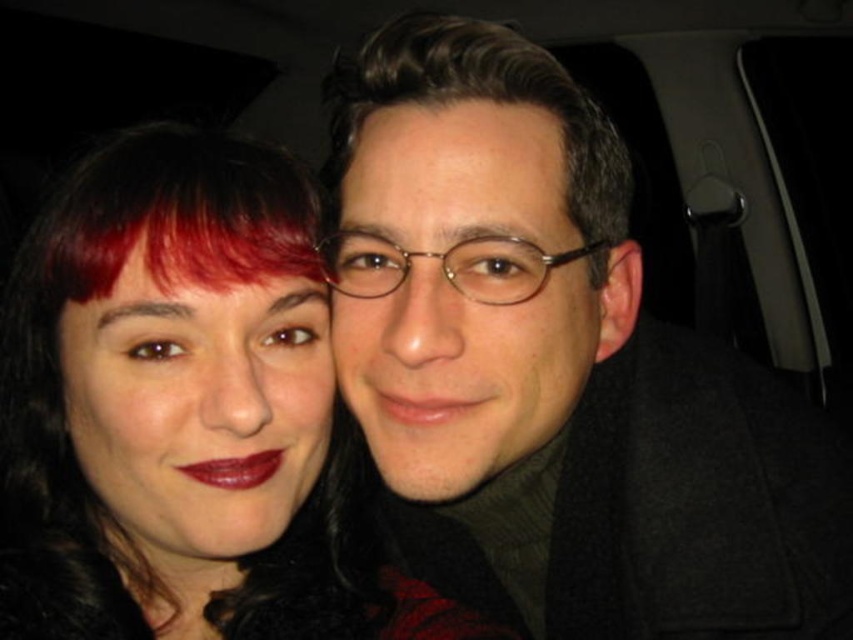
Is matte black coat at center thinner than matte black hair at center?

Yes, matte black coat at center is thinner than matte black hair at center.

Is point (427, 208) closer to viewer compared to point (242, 524)?

Yes, it is in front of point (242, 524).

What are the coordinates of `matte black coat at center` in the screenshot? It's located at (556, 368).

Between point (541, 253) and point (282, 449), which one is positioned behind?

The point (282, 449) is behind.

Is point (706, 483) closer to viewer compared to point (231, 486)?

No, it is behind (231, 486).

Where is `matte black coat at center`? Image resolution: width=853 pixels, height=640 pixels. matte black coat at center is located at coordinates (556, 368).

Where is `matte black coat at center`? The width and height of the screenshot is (853, 640). matte black coat at center is located at coordinates (556, 368).

Between dark brown smooth hair at center and matte red lipstick at center, which one appears on the left side from the viewer's perspective?

matte red lipstick at center

Between dark brown smooth hair at center and matte red lipstick at center, which one is positioned lower?

matte red lipstick at center is below.

Identify the location of dark brown smooth hair at center. (479, 99).